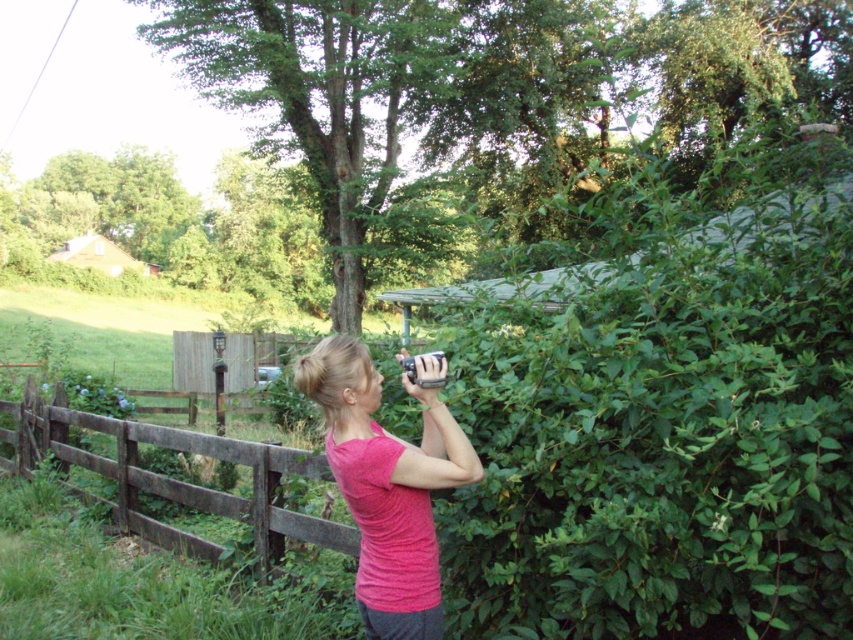
Question: Which point is farther from the camera taking this photo?

Choices:
 (A) (74, 488)
 (B) (334, 397)
 (C) (419, 385)

Answer: (A)

Question: Is brown wooden fence at left to the left of metallic silver camera at upper center from the viewer's perspective?

Choices:
 (A) yes
 (B) no

Answer: (A)

Question: Which point is closer to the camera taking this photo?

Choices:
 (A) (428, 353)
 (B) (54, 451)

Answer: (A)

Question: Does pink fabric shirt at center appear on the right side of brown wooden fence at left?

Choices:
 (A) no
 (B) yes

Answer: (B)

Question: Which object is positioned farthest from the brown wooden fence at left?

Choices:
 (A) pink fabric shirt at center
 (B) metallic silver camera at upper center

Answer: (B)

Question: Considering the relative positions of pink fabric shirt at center and metallic silver camera at upper center in the image provided, where is pink fabric shirt at center located with respect to metallic silver camera at upper center?

Choices:
 (A) above
 (B) below

Answer: (B)